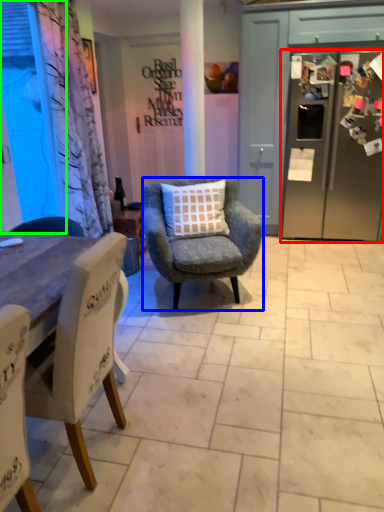
Question: Which object is positioned closest to refrigerator (highlighted by a red box)? Select from chair (highlighted by a blue box) and window screen (highlighted by a green box).

Choices:
 (A) chair
 (B) window screen

Answer: (A)